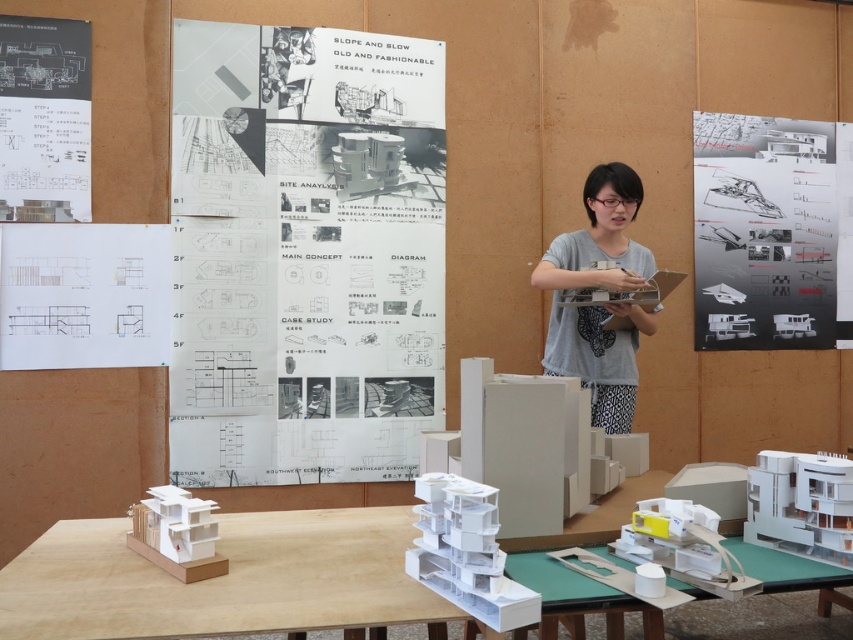
From the picture: You are an architect standing 10 feet away from the white paper at upper right. Can you reach it without moving closer?

The white paper at upper right is 13.13 feet away from the camera, so you are currently 10 feet away from it. Since you need to move an additional 3.13 feet closer to reach it, you cannot reach it without moving closer.

You are standing at the point labeled point (258, 550). You want to walk to the door located at the opposite side of the room. There is a 1.8 meter wide table in your path. Can you pass through without touching the table?

The distance between you and the door is 1.91 meters. Since the table is 1.8 meters wide, there is a 0.11 meter gap between you and the table. This narrow space may be tight, but it is technically possible to pass through without touching the table if you move carefully.

You are an architect who needs to place a 2 meter long blueprint on the workspace. You see the white matte table at lower left and the matte white paper at upper left. Can you fit the blueprint between them?

The white matte table at lower left and the matte white paper at upper left are 1.97 meters apart from each other. Since the blueprint is 2 meters long, it cannot fit between them as the distance is slightly shorter than the blueprint.